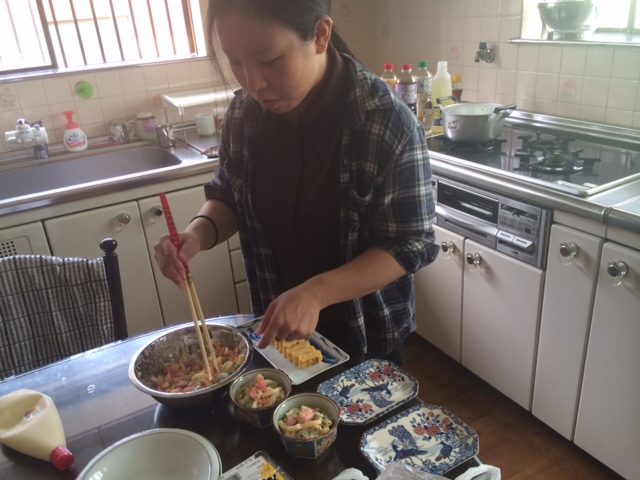
Identify the location of bowl. The width and height of the screenshot is (640, 480). (189, 455).